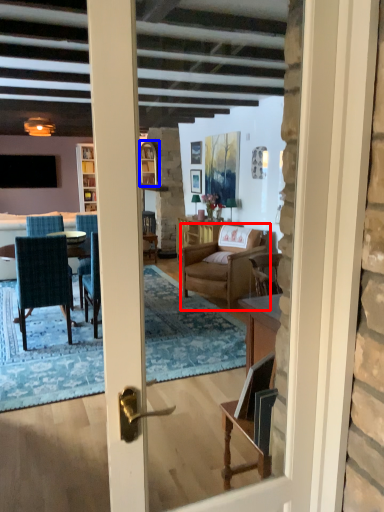
Question: Which of the following is the closest to the observer, chair (highlighted by a red box) or window (highlighted by a blue box)?

Choices:
 (A) chair
 (B) window

Answer: (A)